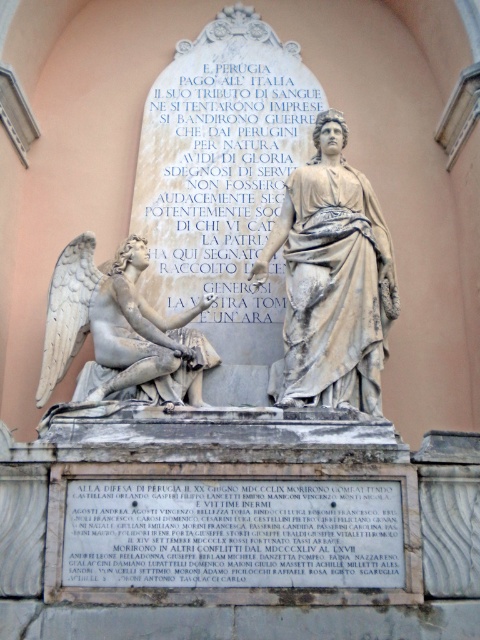
You are standing in front of the monument and want to read the inscription. Which object should you look at first, the white marble inscription at upper center or the white marble angel at left?

The white marble inscription at upper center is above the white marble angel at left, so you should look at the white marble inscription at upper center first.

You are a historian examining the monument. You notice the white marble inscription at upper center and the white marble angel at left. Based on their positions, which one is located to the right of the other?

The white marble inscription at upper center is to the right of the white marble angel at left, so the inscription is positioned to the right side of the angel.